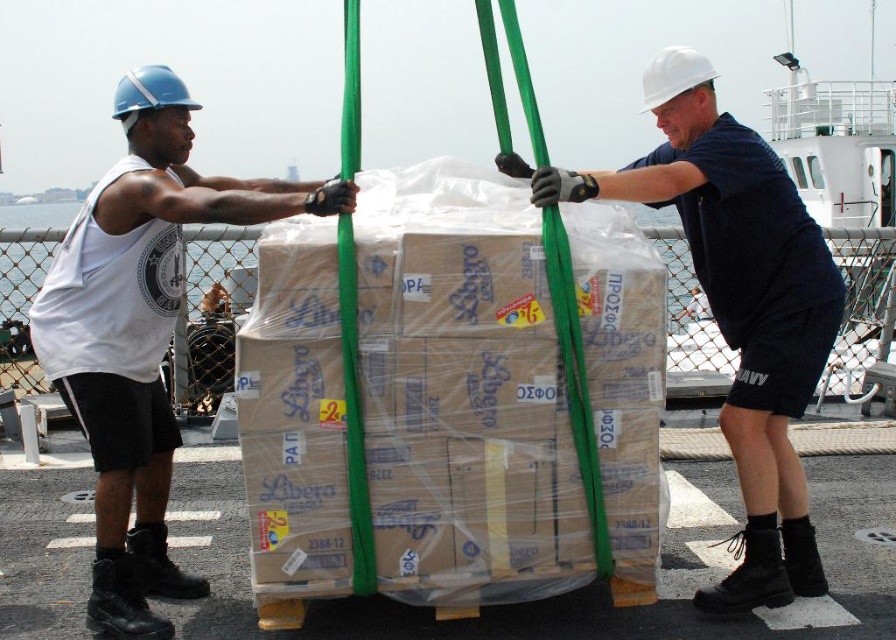
Between white matte tank top at left and white hard hat at upper center, which one is positioned higher?

Positioned higher is white hard hat at upper center.

Between point (141, 120) and point (685, 65), which one is positioned in front?

Positioned in front is point (141, 120).

The height and width of the screenshot is (640, 896). Describe the element at coordinates (141, 332) in the screenshot. I see `white matte tank top at left` at that location.

Locate an element on the screen. white matte tank top at left is located at coordinates pos(141,332).

Is white matte helmet at upper center positioned in front of white hard hat at upper center?

No, white matte helmet at upper center is behind white hard hat at upper center.

Is point (747, 307) in front of point (666, 48)?

That is True.

This screenshot has width=896, height=640. Find the location of `white matte helmet at upper center`. white matte helmet at upper center is located at coordinates (739, 316).

I want to click on white matte tank top at left, so click(x=141, y=332).